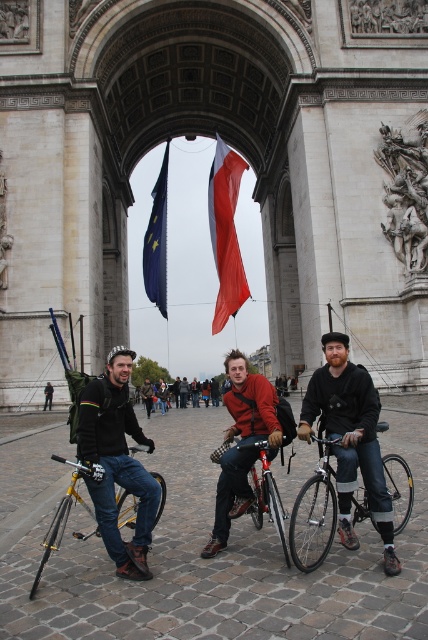
You are a photographer trying to capture a closeup of the red fabric flag at center and the yellow metallic bicycle at left. Since the camera can only focus on one object at a time, which object should you focus on first if you want to ensure the larger object is in focus?

The red fabric flag at center is larger than the yellow metallic bicycle at left, so you should focus on the red fabric flag at center first to ensure it is in focus.